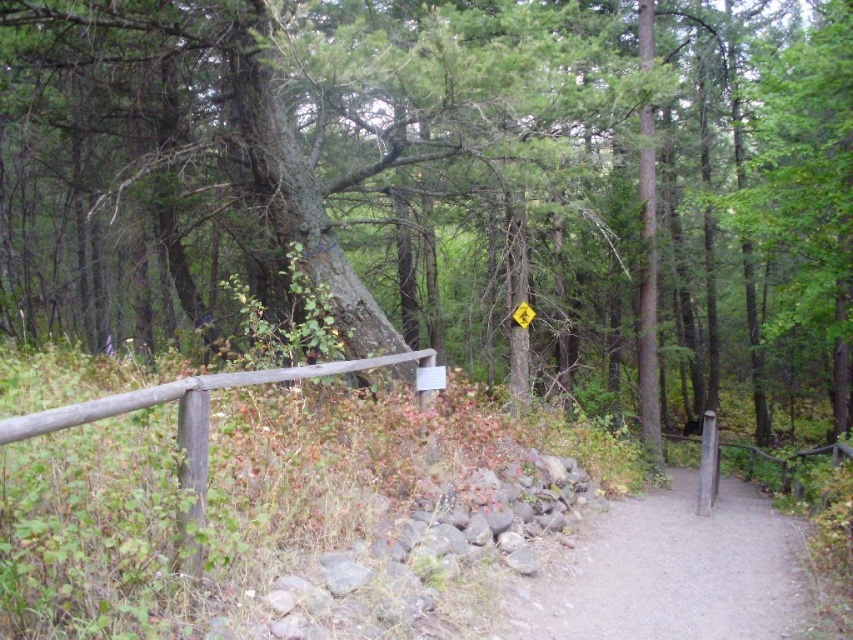
Question: Does dirt/gravel path at center have a smaller size compared to yellow plastic sign at center?

Choices:
 (A) no
 (B) yes

Answer: (A)

Question: Which object appears closest to the camera in this image?

Choices:
 (A) dirt/gravel path at center
 (B) yellow plastic sign at center

Answer: (A)

Question: Among these points, which one is nearest to the camera?

Choices:
 (A) (386, 364)
 (B) (561, 628)
 (C) (521, 307)

Answer: (B)

Question: Is green rough bark tree at center to the right of yellow plastic sign at center from the viewer's perspective?

Choices:
 (A) no
 (B) yes

Answer: (B)

Question: Based on their relative distances, which object is farther from the green rough bark tree at center?

Choices:
 (A) wooden fence at center
 (B) dirt/gravel path at center

Answer: (A)

Question: Is wooden fence at center bigger than yellow plastic sign at center?

Choices:
 (A) no
 (B) yes

Answer: (B)